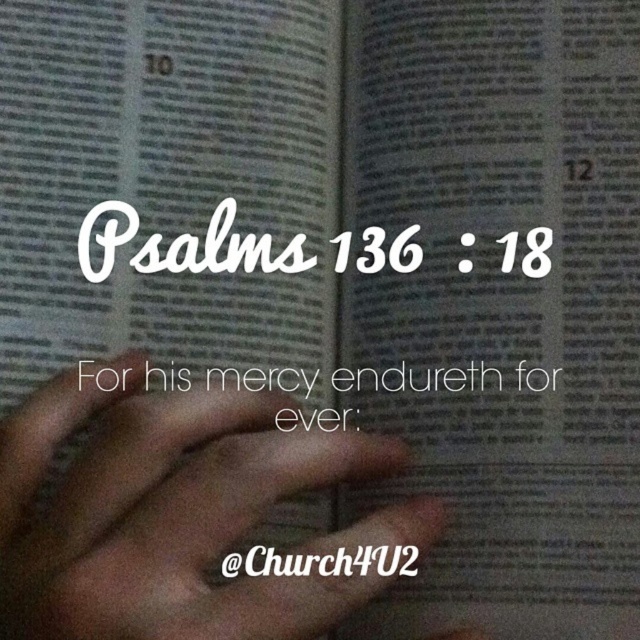
Question: Which point is closer to the camera?

Choices:
 (A) white paper text at center
 (B) brown skin at center

Answer: (B)

Question: Is brown skin at center bigger than white paper text at center?

Choices:
 (A) yes
 (B) no

Answer: (A)

Question: Does brown skin at center appear on the left side of white paper text at center?

Choices:
 (A) yes
 (B) no

Answer: (A)

Question: Which object appears closest to the camera in this image?

Choices:
 (A) brown skin at center
 (B) white paper text at center

Answer: (A)

Question: Is brown skin at center wider than white paper text at center?

Choices:
 (A) no
 (B) yes

Answer: (A)

Question: Among these objects, which one is farthest from the camera?

Choices:
 (A) brown skin at center
 (B) white paper text at center

Answer: (B)